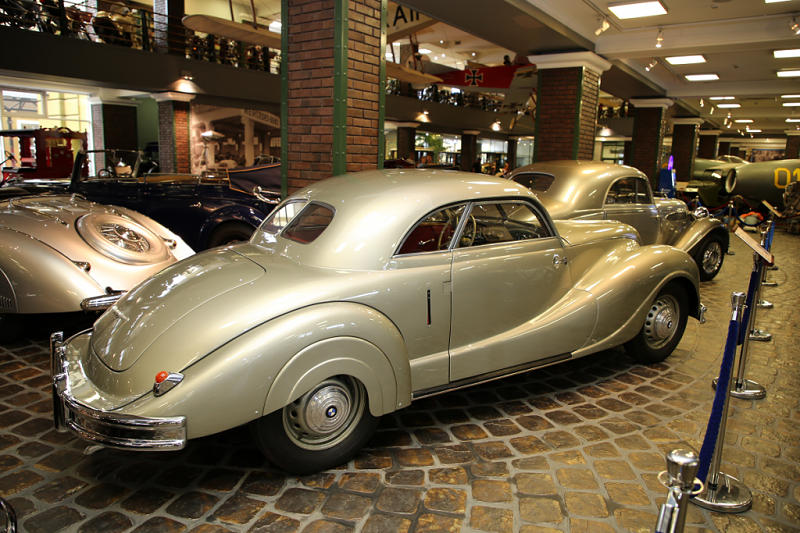
Image resolution: width=800 pixels, height=533 pixels. I want to click on ceiling lights, so click(x=690, y=56), click(x=702, y=75), click(x=788, y=50), click(x=789, y=72), click(x=794, y=100), click(x=724, y=104), click(x=656, y=10).